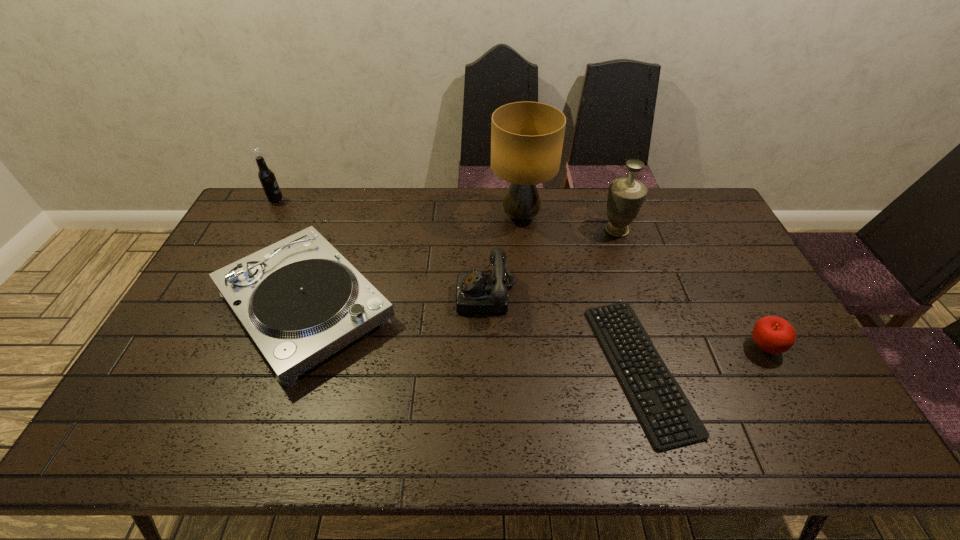
Where is `blank region between the lampshade and the record player`? blank region between the lampshade and the record player is located at coordinates (413, 261).

Where is `free point between the tallest object and the apple`? The height and width of the screenshot is (540, 960). free point between the tallest object and the apple is located at coordinates (642, 282).

Where is `free space between the root beer and the fourth tallest object`? This screenshot has width=960, height=540. free space between the root beer and the fourth tallest object is located at coordinates tap(381, 248).

Where is `free spot between the record player and the sixth shortest object`? free spot between the record player and the sixth shortest object is located at coordinates (461, 268).

Image resolution: width=960 pixels, height=540 pixels. Identify the location of free space between the rightmost object and the second tallest object. (690, 288).

This screenshot has height=540, width=960. Find the location of `free space between the root beer and the second tallest object`. free space between the root beer and the second tallest object is located at coordinates (446, 215).

Identify the location of free space between the second tallest object and the computer keyboard. (628, 299).

Where is `object that is the second closest one to the urn`? The width and height of the screenshot is (960, 540). object that is the second closest one to the urn is located at coordinates (668, 418).

Locate an element on the screen. This screenshot has height=540, width=960. object identified as the second closest to the shortest object is located at coordinates (476, 292).

Where is `vacant region that satisfies the following two spatial constraints: 1. on the label of the root beer; 2. on the left side of the record player`? vacant region that satisfies the following two spatial constraints: 1. on the label of the root beer; 2. on the left side of the record player is located at coordinates (220, 306).